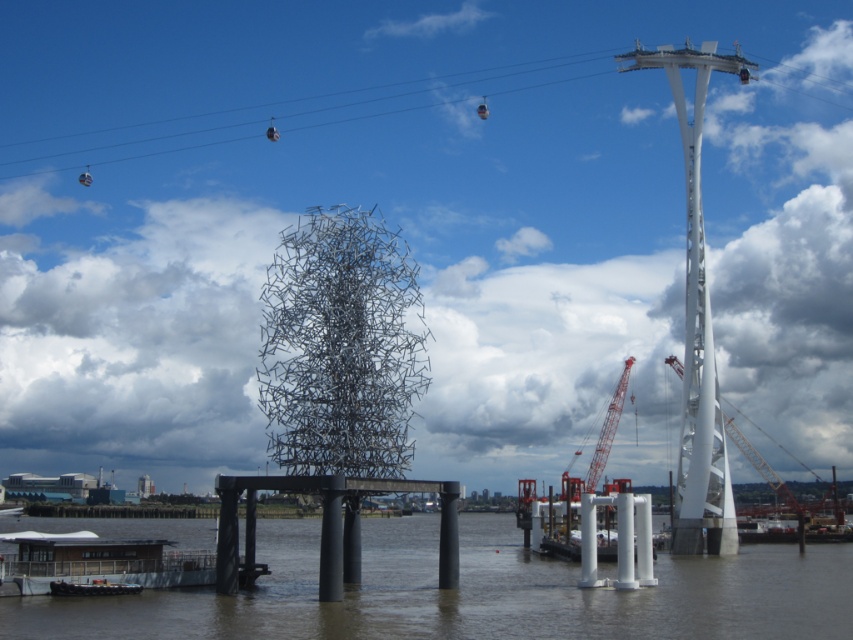
Looking at this image, is white metallic crane at center right wider than red metallic crane at center?

Correct, the width of white metallic crane at center right exceeds that of red metallic crane at center.

Is white metallic crane at center right below red metallic crane at center?

No.

Does point (668, 355) come in front of point (625, 362)?

No.

You are a GUI agent. You are given a task and a screenshot of the screen. Output one action in this format:
    pyautogui.click(x=<x>, y=<y>)
    Task: Click on the white metallic crane at center right
    The height and width of the screenshot is (640, 853).
    Given the screenshot: What is the action you would take?
    pyautogui.click(x=780, y=477)

Who is positioned more to the right, brown murky water at center or white matte boat at lower left?

brown murky water at center is more to the right.

The image size is (853, 640). I want to click on brown murky water at center, so 471,593.

Image resolution: width=853 pixels, height=640 pixels. I want to click on brown murky water at center, so click(x=471, y=593).

Is point (732, 611) farther from camera compared to point (809, 506)?

No, it is in front of (809, 506).

Between point (648, 588) and point (679, 369), which one is positioned behind?

Positioned behind is point (679, 369).

I want to click on brown murky water at center, so click(471, 593).

Where is `brown murky water at center`? Image resolution: width=853 pixels, height=640 pixels. brown murky water at center is located at coordinates (471, 593).